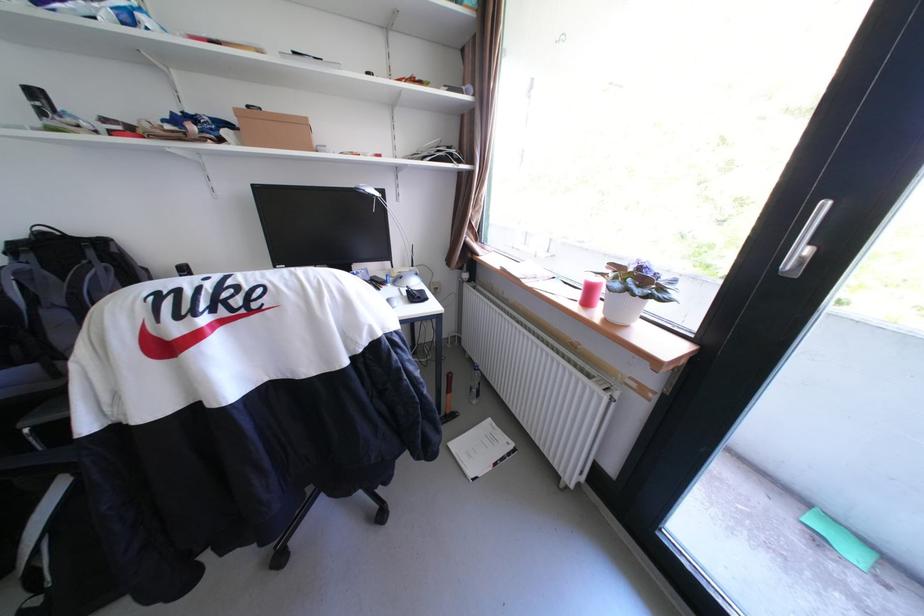
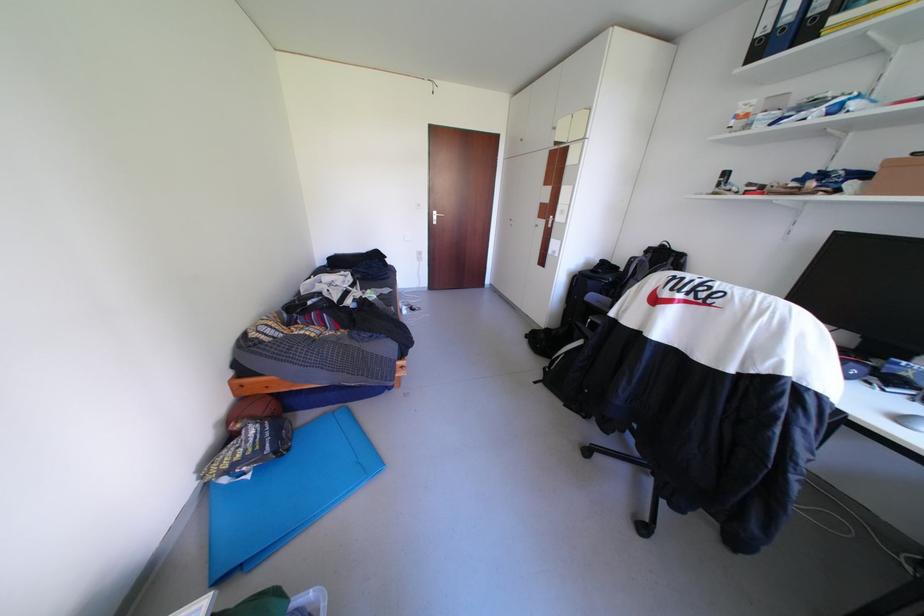
The first image is from the beginning of the video and the second image is from the end. How did the camera likely rotate when shooting the video?

The rotation direction of the camera is left-down.